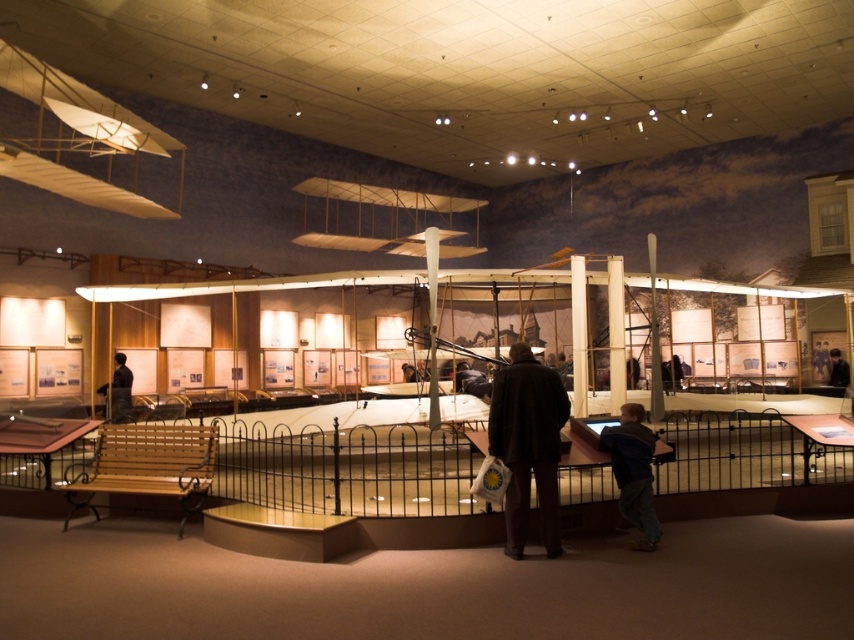
You are a visitor at the museum and want to take a photo of the biplane model. However, there are two coats hanging on a rack at the center of the platform. The dark brown coat at center and the black leather jacket at center are blocking your view. Which coat should you move to get a clear shot of the model?

You should move the dark brown coat at center because it is larger in size than the black leather jacket at center and is more likely blocking the view.

Looking at this image, you are a security guard at the museum and need to determine which item is taller between the dark brown coat at center and the black leather jacket at center. Which one is taller?

The dark brown coat at center is taller than the black leather jacket at center according to the description.